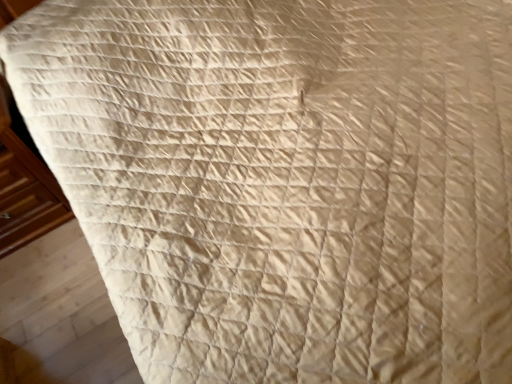
What do you see at coordinates (26, 196) in the screenshot? The image size is (512, 384). I see `wooden cabinet at left` at bounding box center [26, 196].

Find the location of `wooden cabinet at left`. wooden cabinet at left is located at coordinates pyautogui.click(x=26, y=196).

Locate an element on the screen. The width and height of the screenshot is (512, 384). wooden cabinet at left is located at coordinates (26, 196).